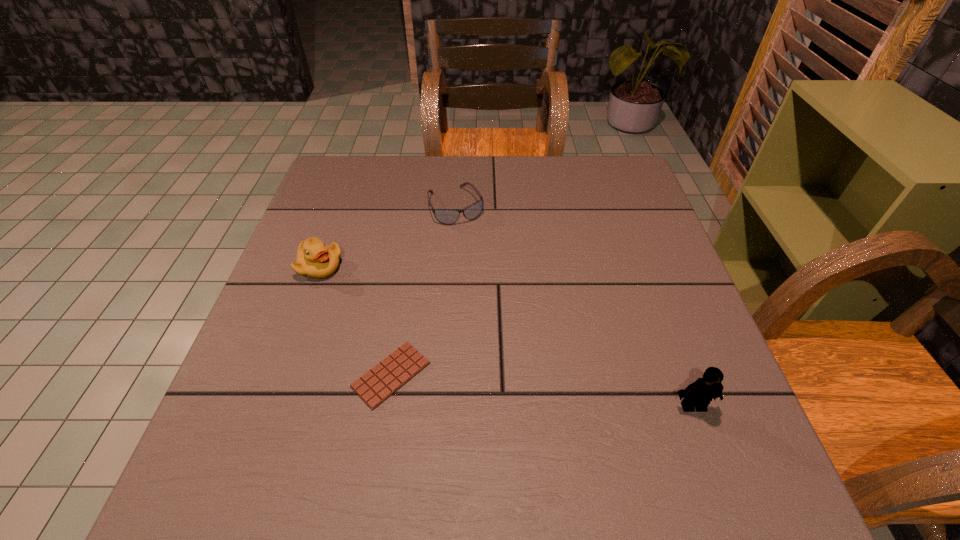
The image size is (960, 540). Find the location of `blank region between the rightmost object and the sunglasses`. blank region between the rightmost object and the sunglasses is located at coordinates (574, 306).

The height and width of the screenshot is (540, 960). I want to click on free area in between the Lego and the leftmost object, so click(507, 336).

Find the location of a particular element. This screenshot has height=540, width=960. empty space between the third nearest object and the third tallest object is located at coordinates (388, 236).

Find the location of a particular element. This screenshot has width=960, height=540. blank region between the duckling and the candy bar is located at coordinates (356, 321).

Where is `vacant area that lies between the second shortest object and the Lego`? vacant area that lies between the second shortest object and the Lego is located at coordinates (574, 306).

Image resolution: width=960 pixels, height=540 pixels. What are the coordinates of `the closest object relative to the shortest object` in the screenshot? It's located at (315, 259).

Locate an element on the screen. The height and width of the screenshot is (540, 960). object that is the nearest to the leftmost object is located at coordinates (384, 379).

Identify the location of free space that satisfies the following two spatial constraints: 1. on the back side of the sunglasses; 2. on the right side of the candy bar. This screenshot has height=540, width=960. (419, 206).

Locate an element on the screen. The height and width of the screenshot is (540, 960). vacant region that satisfies the following two spatial constraints: 1. on the back side of the sunglasses; 2. on the right side of the candy bar is located at coordinates (419, 206).